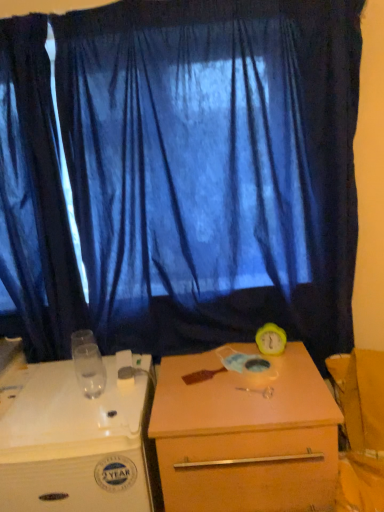
Question: From a real-world perspective, is blue fabric curtain at center, the second curtain when ordered from left to right, physically located above or below white plastic desk at lower left, the second desk positioned from the right?

Choices:
 (A) above
 (B) below

Answer: (A)

Question: From the image's perspective, is blue fabric curtain at center, positioned as the 1th curtain in right-to-left order, positioned above or below white plastic desk at lower left, the 1th desk in the left-to-right sequence?

Choices:
 (A) above
 (B) below

Answer: (A)

Question: Which is farther from the dark blue fabric curtain at left, which is counted as the 1th curtain, starting from the left?

Choices:
 (A) yellow rubber alarm clock at right
 (B) blue fabric curtain at center, positioned as the 1th curtain in right-to-left order
 (C) matte wooden desk at center, placed as the first desk when sorted from right to left
 (D) white plastic desk at lower left, the second desk positioned from the right

Answer: (A)

Question: Which object is the farthest from the white plastic desk at lower left, the 1th desk in the left-to-right sequence?

Choices:
 (A) blue fabric curtain at center, positioned as the 1th curtain in right-to-left order
 (B) matte wooden desk at center, placed as the first desk when sorted from right to left
 (C) dark blue fabric curtain at left, which is counted as the 1th curtain, starting from the left
 (D) yellow rubber alarm clock at right

Answer: (D)